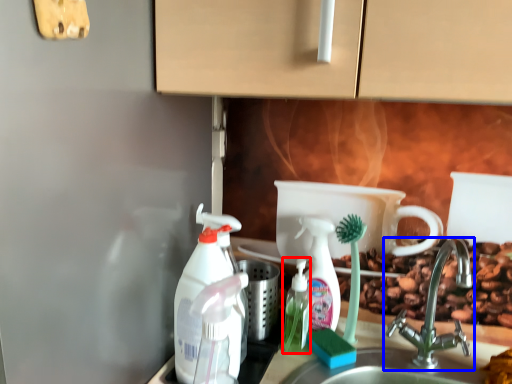
Question: Which of the following is the closest to the observer, bottle (highlighted by a red box) or tap (highlighted by a blue box)?

Choices:
 (A) bottle
 (B) tap

Answer: (B)